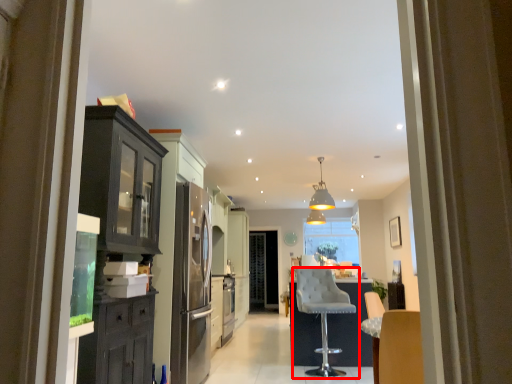
Question: In this image, where is chair (annotated by the red box) located relative to light fixture?

Choices:
 (A) left
 (B) right

Answer: (A)